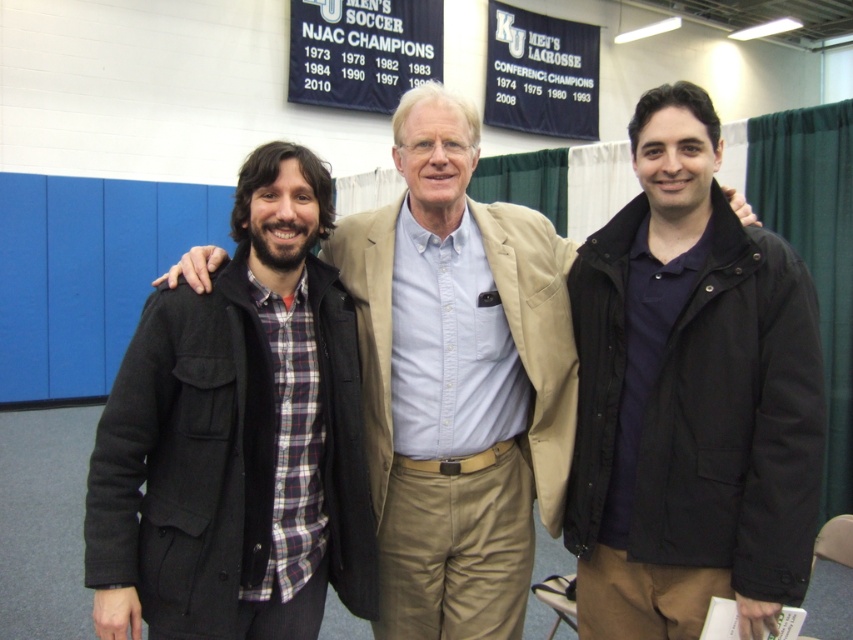
Question: Which of the following is the farthest from the observer?

Choices:
 (A) matte black coat at left
 (B) plaid shirt at center
 (C) black matte jacket at right

Answer: (B)

Question: Can you confirm if black matte jacket at right is bigger than matte black coat at left?

Choices:
 (A) yes
 (B) no

Answer: (A)

Question: Which point is farther to the camera?

Choices:
 (A) (456, 161)
 (B) (769, 486)

Answer: (A)

Question: Is the position of matte black coat at left less distant than that of plaid shirt at center?

Choices:
 (A) no
 (B) yes

Answer: (B)

Question: Which object is positioned closest to the plaid shirt at center?

Choices:
 (A) black matte jacket at right
 (B) matte black coat at left

Answer: (A)

Question: Does black matte jacket at right have a larger size compared to plaid shirt at center?

Choices:
 (A) no
 (B) yes

Answer: (A)